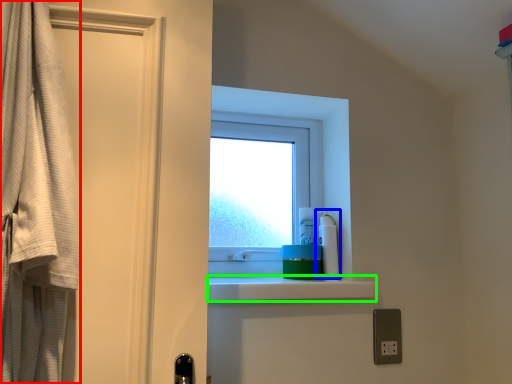
Question: Estimate the real-world distances between objects in this image. Which object is closer to curtain (highlighted by a red box), cleaning product (highlighted by a blue box) or balustrade (highlighted by a green box)?

Choices:
 (A) cleaning product
 (B) balustrade

Answer: (B)